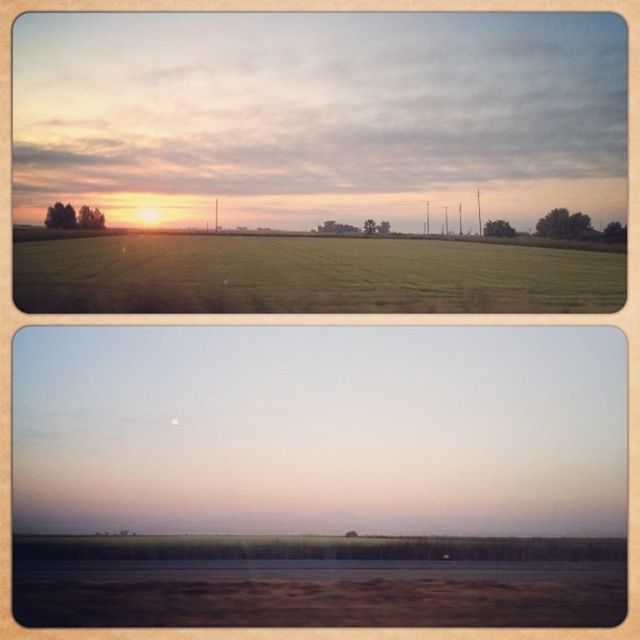
Does transparent glass train window at center appear on the left side of green matte tree at center?

No, transparent glass train window at center is not to the left of green matte tree at center.

Does transparent glass train window at center have a greater height compared to green matte tree at center?

Indeed, transparent glass train window at center has a greater height compared to green matte tree at center.

Is point (42, 566) closer to viewer compared to point (97, 212)?

Yes, point (42, 566) is closer to viewer.

Locate an element on the screen. The width and height of the screenshot is (640, 640). transparent glass train window at center is located at coordinates (317, 476).

Who is positioned more to the left, green leafy tree at center or green leafy tree at right?

green leafy tree at center is more to the left.

From the picture: Can you confirm if green leafy tree at center is shorter than green leafy tree at right?

Correct, green leafy tree at center is not as tall as green leafy tree at right.

Is point (490, 227) positioned before point (602, 234)?

No, it is behind (602, 234).

Identify the location of green leafy tree at center. The height and width of the screenshot is (640, 640). (499, 228).

Does transparent glass train window at center have a larger size compared to green matte trees at left?

Correct, transparent glass train window at center is larger in size than green matte trees at left.

Can you confirm if transparent glass train window at center is positioned below green matte trees at left?

Result: Yes, transparent glass train window at center is below green matte trees at left.

Is point (387, 589) positioned behind point (70, 216)?

No, it is not.

The image size is (640, 640). I want to click on transparent glass train window at center, so click(x=317, y=476).